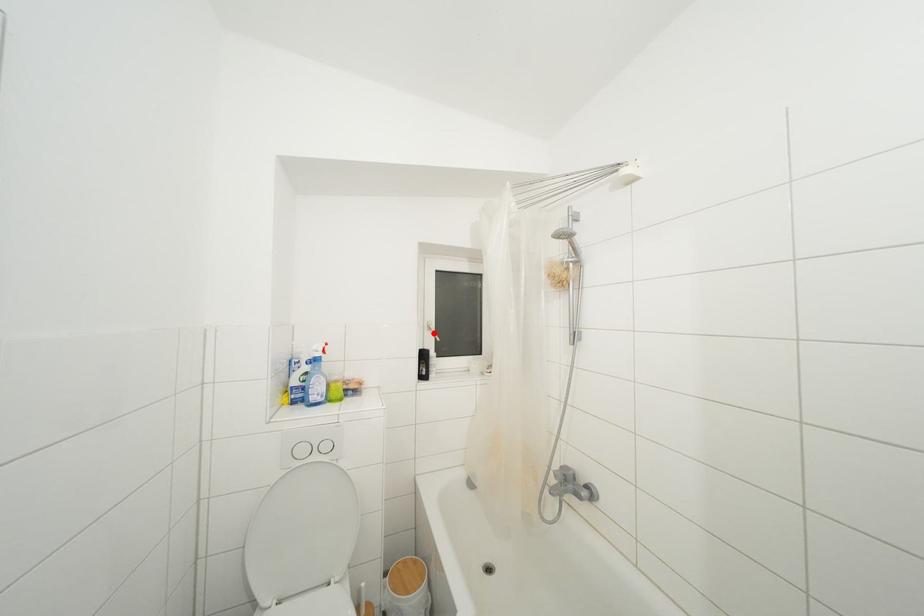
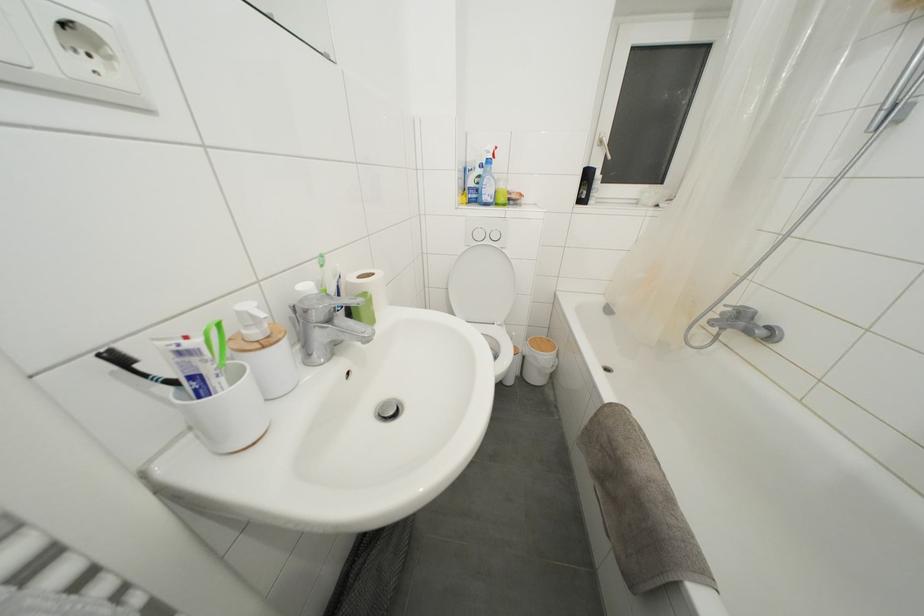
Question: I am providing you with two images of the same scene from different viewpoints. In image1, a red point is highlighted. Considering the same 3D point in image2, which of the following is correct?

Choices:
 (A) It is closer
 (B) It is farther

Answer: (A)